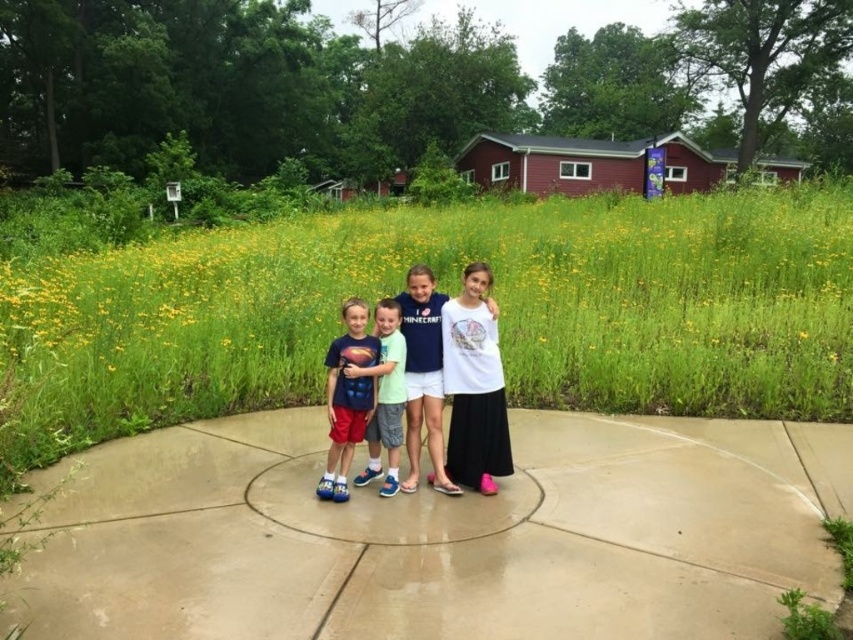
Question: Which point is farther to the camera?

Choices:
 (A) (450, 422)
 (B) (392, 577)
 (C) (428, 438)
 (D) (397, 330)

Answer: (A)

Question: Which point appears closest to the camera in this image?

Choices:
 (A) (550, 616)
 (B) (379, 470)
 (C) (491, 305)
 (D) (341, 451)

Answer: (A)

Question: Is white matte shirt at center smaller than matte blue shorts at center?

Choices:
 (A) yes
 (B) no

Answer: (B)

Question: In this image, where is smooth concrete pavement at center located relative to white matte skirt at center?

Choices:
 (A) left
 (B) right

Answer: (A)

Question: Which point is closer to the camera?

Choices:
 (A) light blue t-shirt at center
 (B) smooth concrete pavement at center

Answer: (B)

Question: Does smooth concrete pavement at center have a larger size compared to white matte shirt at center?

Choices:
 (A) yes
 (B) no

Answer: (A)